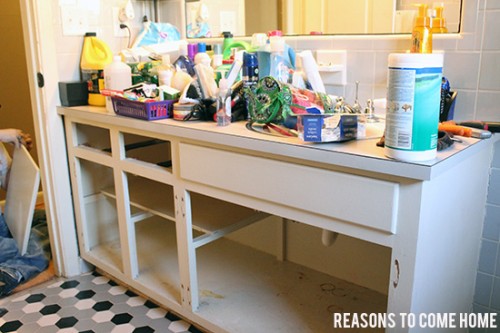
Identify the location of lightswitch. (69, 20), (84, 22).